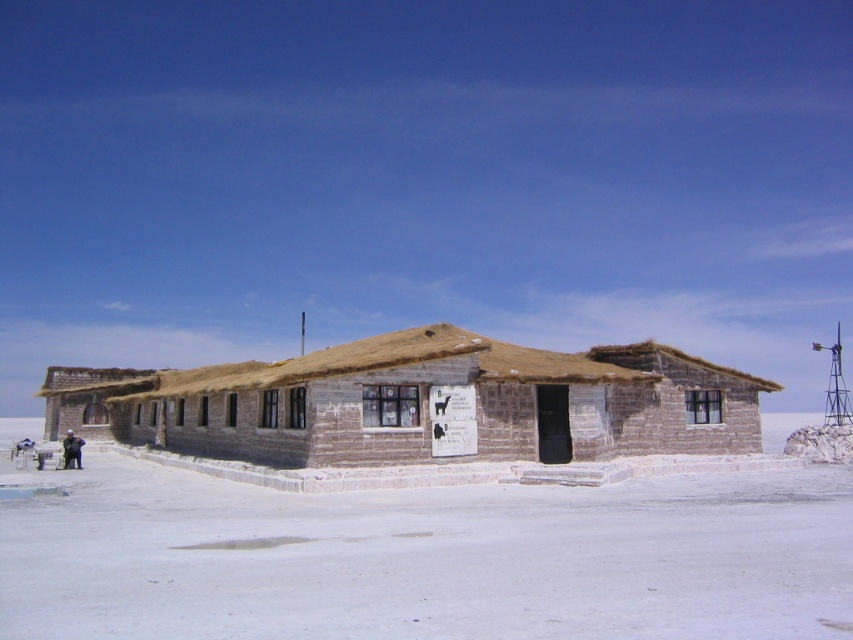
You are standing at the entrance of the rustic building and want to place the dark blue fabric jacket at lower left on the white salt flat at center. Can you do this without the jacket being completely hidden?

The white salt flat at center is taller than dark blue fabric jacket at lower left, so placing the jacket on the salt flat would result in the jacket being completely hidden since it is shorter than the salt flat.

You are standing in front of the rustic building in the snow. You notice two features at the center of the image. Which one takes up more space, the white salt flat at center or the rustic wooden hut at center?

The rustic wooden hut at center occupies more space than the white salt flat at center.